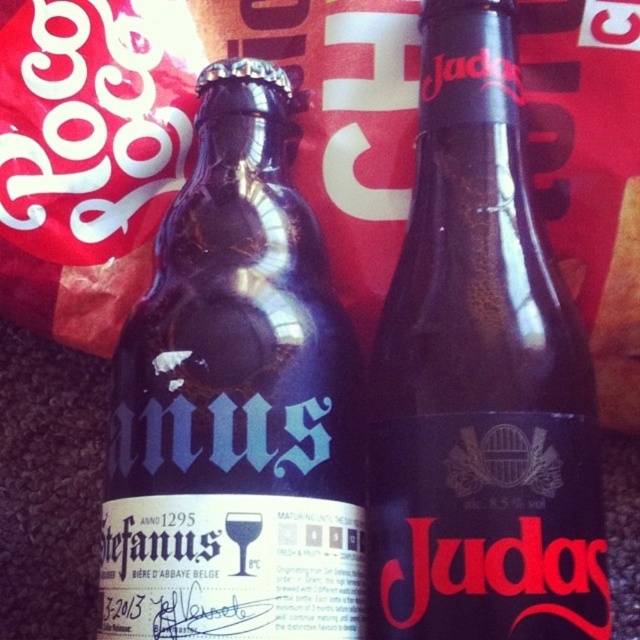
Which is in front, point (120, 428) or point (476, 515)?

Point (476, 515) is in front.

Is blue glass bottle at left wider than dark glass bottle at center?

Yes.

Which is behind, point (244, 488) or point (477, 614)?

Point (244, 488)

Image resolution: width=640 pixels, height=640 pixels. Find the location of `blue glass bottle at left`. blue glass bottle at left is located at coordinates (236, 403).